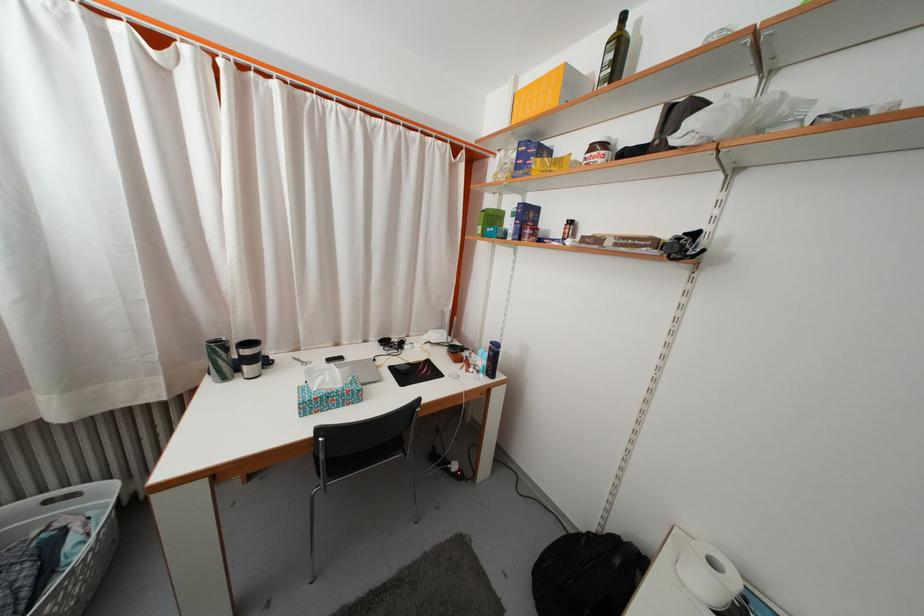
Which object does [249,358] point to?

It refers to a black travel mug.